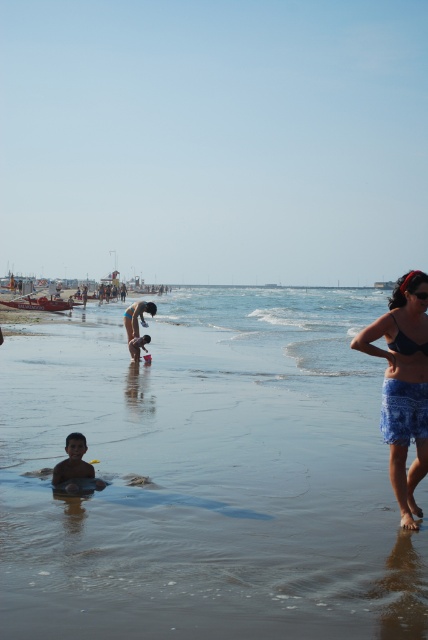
Question: Which point is closer to the camera?

Choices:
 (A) smooth skin child at lower left
 (B) black matte swimsuit at right

Answer: (B)

Question: Which point is closer to the camera?

Choices:
 (A) black matte swimsuit at right
 (B) smooth sand at lower center
 (C) matte black swimsuit at center
 (D) smooth skin child at lower left

Answer: (A)

Question: Which object appears farthest from the camera in this image?

Choices:
 (A) blue printed skirt at lower right
 (B) smooth skin child at lower left
 (C) smooth sand at lower center
 (D) black matte swimsuit at right

Answer: (C)

Question: Can you confirm if smooth skin child at lower left is smaller than black matte swimsuit at right?

Choices:
 (A) no
 (B) yes

Answer: (A)

Question: Is matte black swimsuit at center below black matte swimsuit at right?

Choices:
 (A) no
 (B) yes

Answer: (A)

Question: Does blue printed skirt at lower right have a larger size compared to smooth sand at lower center?

Choices:
 (A) yes
 (B) no

Answer: (A)